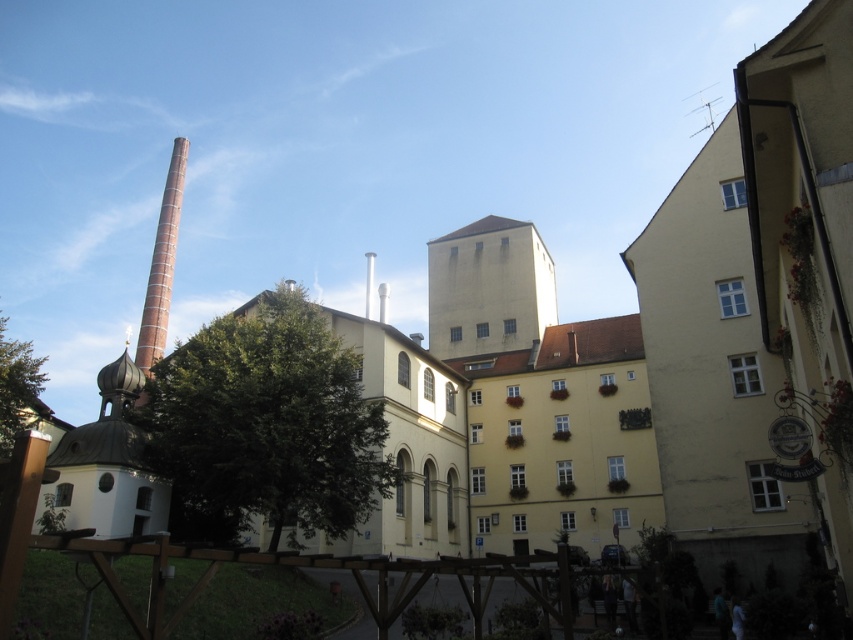
You are a photographer planning to capture the beige concrete tower at center and the brick textured chimney at left in a single shot. Based on their positions, which one will appear closer to the camera in the photo?

The beige concrete tower at center will appear closer to the camera because it is positioned in front of the brick textured chimney at left.

In the scene shown: You are standing at the point marked as point (x=265, y=426) in the image. Looking around, you see a green leafy tree at center. Can you tell me what is located exactly at your current position?

The green leafy tree at center is located exactly at point (x=265, y=426), so that is where you are standing.

You are standing in front of the building and want to locate the beige concrete tower at center and the brick textured chimney at left. Which one is positioned to the right of the other?

The beige concrete tower at center is positioned to the right of the brick textured chimney at left.